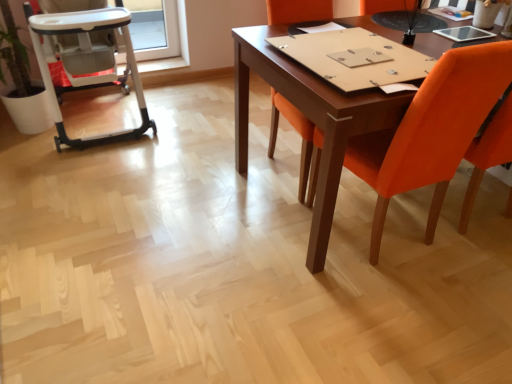
Question: From a real-world perspective, is white plastic high chair at left physically above orange fabric chair at right, which ranks as the 1th chair in right-to-left order?

Choices:
 (A) no
 (B) yes

Answer: (A)

Question: From the image's perspective, is white plastic high chair at left on orange fabric chair at right, which ranks as the 1th chair in right-to-left order?

Choices:
 (A) no
 (B) yes

Answer: (B)

Question: Considering the relative positions of white plastic high chair at left and orange fabric chair at right, the 2th chair when ordered from left to right, in the image provided, is white plastic high chair at left to the left of orange fabric chair at right, the 2th chair when ordered from left to right, from the viewer's perspective?

Choices:
 (A) yes
 (B) no

Answer: (A)

Question: Does white plastic high chair at left have a greater height compared to orange fabric chair at right, the 2th chair when ordered from left to right?

Choices:
 (A) yes
 (B) no

Answer: (B)

Question: Does white plastic high chair at left have a larger size compared to orange fabric chair at right, the 2th chair when ordered from left to right?

Choices:
 (A) no
 (B) yes

Answer: (B)

Question: Looking at their shapes, would you say white plastic high chair at left is wider or thinner than orange fabric chair at center, the 2th chair when ordered from right to left?

Choices:
 (A) wide
 (B) thin

Answer: (A)

Question: Does point (64, 139) appear closer or farther from the camera than point (305, 132)?

Choices:
 (A) farther
 (B) closer

Answer: (A)

Question: Looking at the image, does white plastic high chair at left seem bigger or smaller compared to orange fabric chair at center, the 2th chair when ordered from right to left?

Choices:
 (A) small
 (B) big

Answer: (B)

Question: From a real-world perspective, is white plastic high chair at left above or below orange fabric chair at center, acting as the first chair starting from the left?

Choices:
 (A) above
 (B) below

Answer: (B)

Question: Looking at the image, does orange fabric chair at center, the 2th chair when ordered from right to left, seem bigger or smaller compared to orange fabric chair at right, the 2th chair when ordered from left to right?

Choices:
 (A) small
 (B) big

Answer: (B)

Question: From a real-world perspective, is orange fabric chair at center, the 2th chair when ordered from right to left, physically located above or below orange fabric chair at right, the 2th chair when ordered from left to right?

Choices:
 (A) above
 (B) below

Answer: (A)

Question: Is point (269, 150) closer or farther from the camera than point (501, 43)?

Choices:
 (A) farther
 (B) closer

Answer: (A)

Question: From the image's perspective, is orange fabric chair at center, acting as the first chair starting from the left, positioned above or below orange fabric chair at right, which ranks as the 1th chair in right-to-left order?

Choices:
 (A) below
 (B) above

Answer: (B)

Question: From a real-world perspective, relative to white plastic high chair at left, is orange fabric chair at center, the 2th chair when ordered from right to left, vertically above or below?

Choices:
 (A) below
 (B) above

Answer: (B)

Question: Looking at the image, does orange fabric chair at center, the 2th chair when ordered from right to left, seem bigger or smaller compared to white plastic high chair at left?

Choices:
 (A) small
 (B) big

Answer: (A)